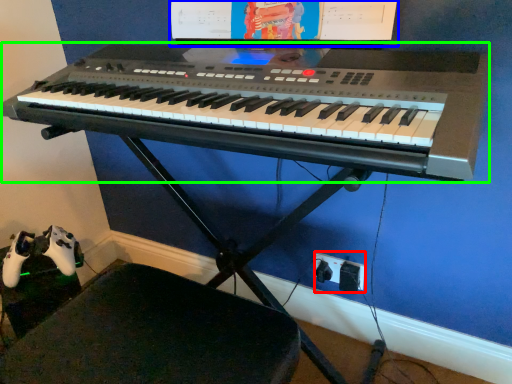
Question: Estimate the real-world distances between objects in this image. Which object is farther from plug (highlighted by a red box), computer monitor (highlighted by a blue box) or musical keyboard (highlighted by a green box)?

Choices:
 (A) computer monitor
 (B) musical keyboard

Answer: (A)